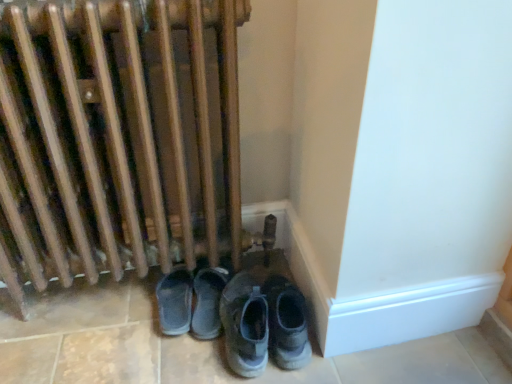
Question: From the image's perspective, is gray fabric sneakers at lower center, placed as the 3th footwear when sorted from left to right, on gray suede sneakers at lower center, the 2th footwear positioned from the left?

Choices:
 (A) yes
 (B) no

Answer: (A)

Question: Can you confirm if gray fabric sneakers at lower center, placed as the 3th footwear when sorted from left to right, is thinner than gray suede sneakers at lower center, which ranks as the second footwear in right-to-left order?

Choices:
 (A) yes
 (B) no

Answer: (B)

Question: Considering the relative positions of gray fabric sneakers at lower center, placed as the 3th footwear when sorted from left to right, and gray suede sneakers at lower center, the 2th footwear positioned from the left, in the image provided, is gray fabric sneakers at lower center, placed as the 3th footwear when sorted from left to right, to the left of gray suede sneakers at lower center, the 2th footwear positioned from the left, from the viewer's perspective?

Choices:
 (A) yes
 (B) no

Answer: (B)

Question: Can you confirm if gray fabric sneakers at lower center, which ranks as the 1th footwear in right-to-left order, is bigger than gray suede sneakers at lower center, which ranks as the second footwear in right-to-left order?

Choices:
 (A) no
 (B) yes

Answer: (A)

Question: Is the depth of gray fabric sneakers at lower center, placed as the 3th footwear when sorted from left to right, greater than that of gray suede sneakers at lower center, which ranks as the second footwear in right-to-left order?

Choices:
 (A) no
 (B) yes

Answer: (B)

Question: Is gray suede sneakers at lower center, the 2th footwear positioned from the left, wider or thinner than gray fabric sneakers at lower center, which ranks as the 1th footwear in right-to-left order?

Choices:
 (A) wide
 (B) thin

Answer: (B)

Question: Is gray suede sneakers at lower center, which ranks as the second footwear in right-to-left order, spatially inside gray fabric sneakers at lower center, placed as the 3th footwear when sorted from left to right, or outside of it?

Choices:
 (A) inside
 (B) outside

Answer: (B)

Question: From a real-world perspective, is gray suede sneakers at lower center, which ranks as the second footwear in right-to-left order, above or below gray fabric sneakers at lower center, which ranks as the 1th footwear in right-to-left order?

Choices:
 (A) above
 (B) below

Answer: (B)

Question: From the image's perspective, is gray suede sneakers at lower center, which ranks as the second footwear in right-to-left order, positioned above or below gray fabric sneakers at lower center, placed as the 3th footwear when sorted from left to right?

Choices:
 (A) above
 (B) below

Answer: (B)

Question: Is point (303, 364) closer or farther from the camera than point (166, 278)?

Choices:
 (A) closer
 (B) farther

Answer: (A)

Question: In terms of height, does gray fabric sneakers at lower center, which ranks as the 1th footwear in right-to-left order, look taller or shorter compared to gray suede shoes at lower center, marked as the first footwear in a left-to-right arrangement?

Choices:
 (A) tall
 (B) short

Answer: (A)

Question: From a real-world perspective, is gray fabric sneakers at lower center, which ranks as the 1th footwear in right-to-left order, positioned above or below gray suede shoes at lower center, marked as the first footwear in a left-to-right arrangement?

Choices:
 (A) above
 (B) below

Answer: (A)

Question: Looking at the image, does gray fabric sneakers at lower center, which ranks as the 1th footwear in right-to-left order, seem bigger or smaller compared to gray suede shoes at lower center, marked as the first footwear in a left-to-right arrangement?

Choices:
 (A) big
 (B) small

Answer: (A)

Question: From the image's perspective, is gray fabric sneakers at lower center, placed as the 3th footwear when sorted from left to right, positioned above or below gray suede sneakers at lower center, which ranks as the second footwear in right-to-left order?

Choices:
 (A) below
 (B) above

Answer: (B)

Question: Considering the positions of gray fabric sneakers at lower center, which ranks as the 1th footwear in right-to-left order, and gray suede sneakers at lower center, the 2th footwear positioned from the left, in the image, is gray fabric sneakers at lower center, which ranks as the 1th footwear in right-to-left order, wider or thinner than gray suede sneakers at lower center, the 2th footwear positioned from the left,?

Choices:
 (A) thin
 (B) wide

Answer: (B)